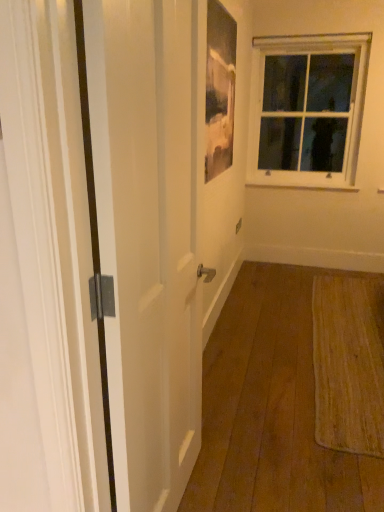
Identify the location of vacant space situated above white painted wood at upper right (from a real-world perspective). This screenshot has height=512, width=384. (302, 175).